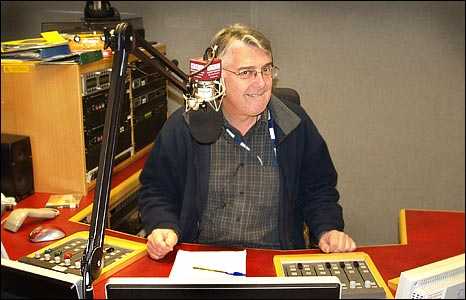
You are a GUI agent. You are given a task and a screenshot of the screen. Output one action in this format:
    pyautogui.click(x=<x>, y=<y>)
    Task: Click on the headphone wires
    This screenshot has height=300, width=466.
    Given the screenshot: What is the action you would take?
    pyautogui.click(x=240, y=164)